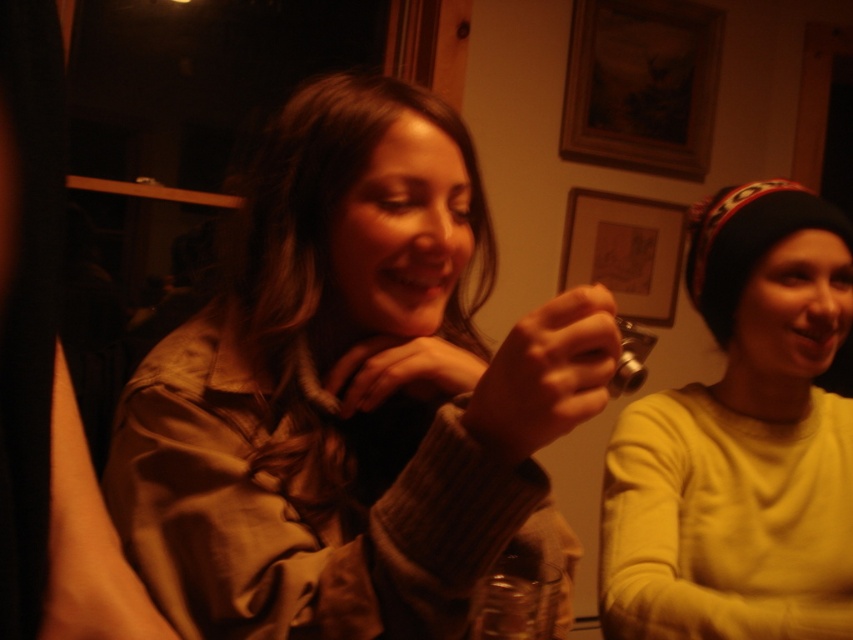
Based on the scene description, where is the matte yellow sweater located? Please provide coordinates in the format of a point like point (x=741, y=442).

The matte yellow sweater at right is located at point (x=741, y=442).

You are a photographer trying to capture a candid shot of the two people in the scene. The matte yellow sweater at right and the wooden frame at upper center are both in your viewfinder. Which object is positioned lower in the image?

The matte yellow sweater at right is positioned below the wooden frame at upper center, so it is lower in the image.

Based on the photo, you are standing in the cozy, dimly lit environment shown in the image. You need to locate the matte brown jacket at center. Which direction should you look to find it?

The matte brown jacket at center is located at point 0.617 on the x axis and 0.414 on the y axis, so you should look towards the central area slightly to the right and middle of the image.